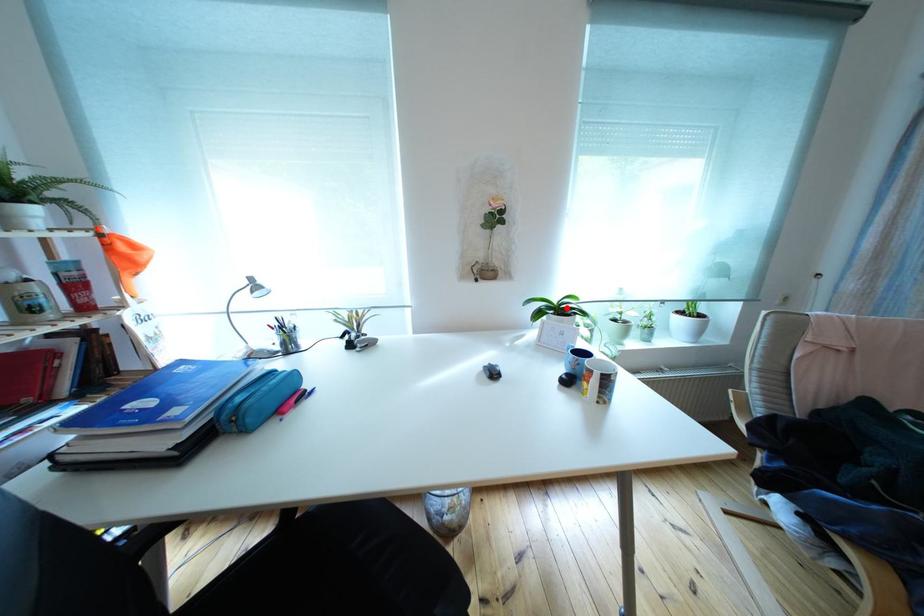
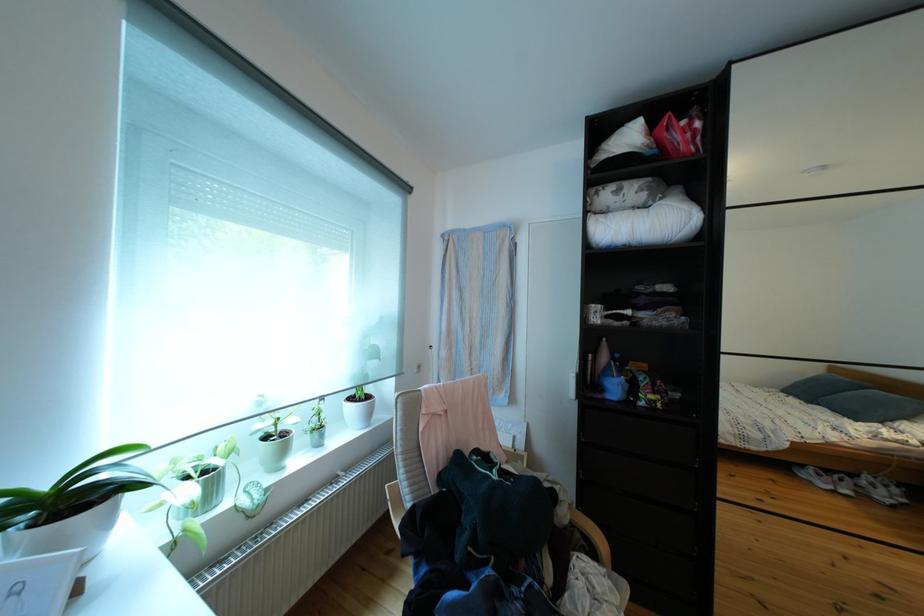
Find the pixel in the second image that matches the highlighted location in the first image.

(55, 492)